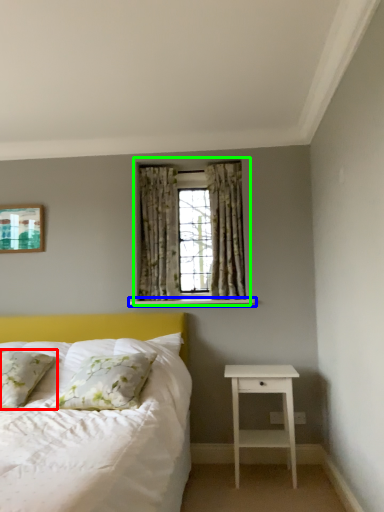
Question: Considering the real-world distances, which object is farthest from pillow (highlighted by a red box)? window sill (highlighted by a blue box) or window (highlighted by a green box)?

Choices:
 (A) window sill
 (B) window

Answer: (B)